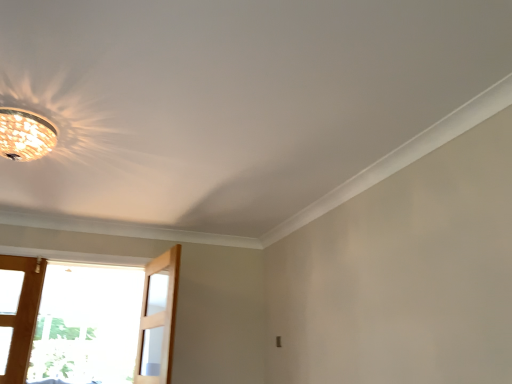
Question: Does clear glass screen door at lower left have a lesser width compared to matte glass chandelier at upper left?

Choices:
 (A) no
 (B) yes

Answer: (B)

Question: Considering the relative positions of clear glass screen door at lower left and matte glass chandelier at upper left in the image provided, is clear glass screen door at lower left to the left of matte glass chandelier at upper left from the viewer's perspective?

Choices:
 (A) no
 (B) yes

Answer: (A)

Question: Is clear glass screen door at lower left positioned before matte glass chandelier at upper left?

Choices:
 (A) yes
 (B) no

Answer: (B)

Question: Is clear glass screen door at lower left aimed at matte glass chandelier at upper left?

Choices:
 (A) yes
 (B) no

Answer: (B)

Question: Can you confirm if clear glass screen door at lower left is taller than matte glass chandelier at upper left?

Choices:
 (A) yes
 (B) no

Answer: (A)

Question: Is clear glass screen door at lower left facing away from matte glass chandelier at upper left?

Choices:
 (A) yes
 (B) no

Answer: (B)

Question: From the image's perspective, does matte glass chandelier at upper left appear lower than clear glass screen door at lower left?

Choices:
 (A) no
 (B) yes

Answer: (A)

Question: Considering the relative sizes of matte glass chandelier at upper left and clear glass screen door at lower left in the image provided, is matte glass chandelier at upper left thinner than clear glass screen door at lower left?

Choices:
 (A) yes
 (B) no

Answer: (B)

Question: From a real-world perspective, is matte glass chandelier at upper left below clear glass screen door at lower left?

Choices:
 (A) no
 (B) yes

Answer: (A)

Question: Is matte glass chandelier at upper left at the right side of clear glass screen door at lower left?

Choices:
 (A) yes
 (B) no

Answer: (B)

Question: Is matte glass chandelier at upper left outside of clear glass screen door at lower left?

Choices:
 (A) yes
 (B) no

Answer: (A)

Question: Is matte glass chandelier at upper left next to clear glass screen door at lower left and touching it?

Choices:
 (A) yes
 (B) no

Answer: (B)

Question: From a real-world perspective, relative to matte glass chandelier at upper left, is clear glass screen door at lower left vertically above or below?

Choices:
 (A) above
 (B) below

Answer: (B)